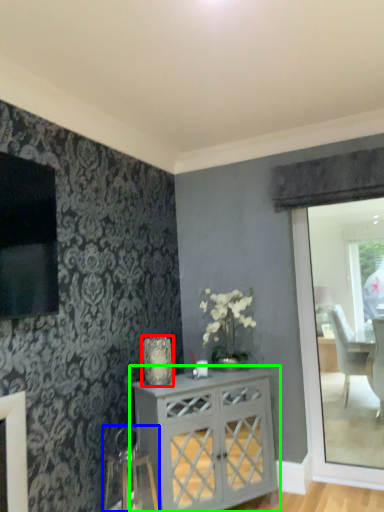
Question: Based on their relative distances, which object is farther from vase (highlighted by a red box)? Choose from swivel chair (highlighted by a blue box) and desk (highlighted by a green box).

Choices:
 (A) swivel chair
 (B) desk

Answer: (A)